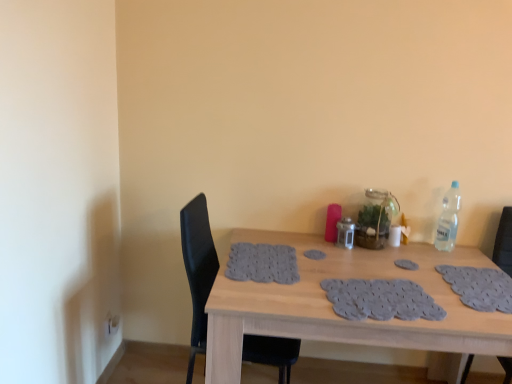
Locate an element on the screen. vacant space to the right of gray fabric placemat at center, placed as the second footprint when sorted from left to right is located at coordinates (445, 268).